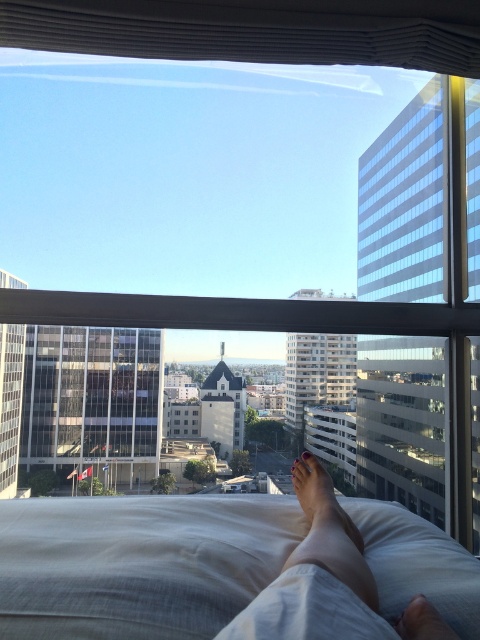
You are designing a virtual reality simulation of this scene. To ensure accurate placement, you need to know the exact 2D coordinates of the white soft pillow at lower center. What are its coordinates?

The white soft pillow at lower center is located at coordinates (139, 563).

You are standing on a balcony and looking at the city. There are two points marked in the scene. The first point is at coordinates point (324, 552) and the second is at point (309, 481). Which point is closer to you?

Point (324, 552) is in front of point (309, 481), so it is closer to you.